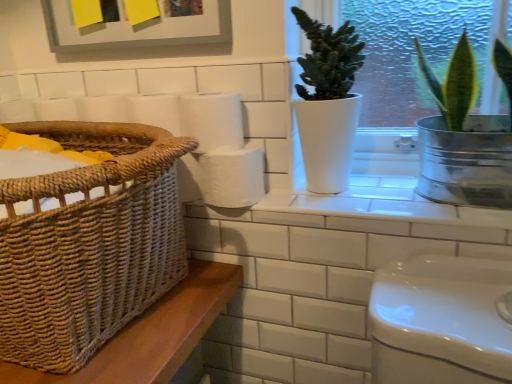
What are the coordinates of `vacant space to the right of white matte pot at center, the 1th houseplant viewed from the left` in the screenshot? It's located at (394, 195).